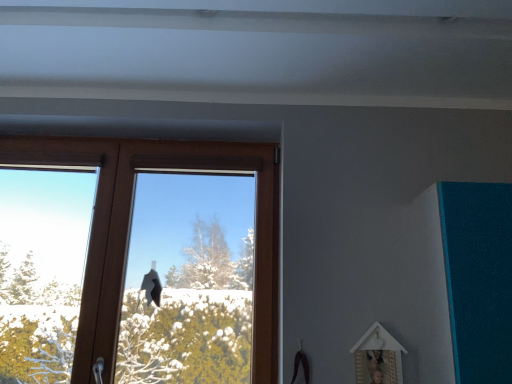
This screenshot has width=512, height=384. What do you see at coordinates (130, 229) in the screenshot?
I see `brown wooden window at center` at bounding box center [130, 229].

Measure the distance between point (220, 145) and camera.

6.35 feet.

Locate an element on the screen. The image size is (512, 384). brown wooden window at center is located at coordinates (130, 229).

Measure the distance between wooden picture frame at lower right and camera.

The depth of wooden picture frame at lower right is 1.49 meters.

Image resolution: width=512 pixels, height=384 pixels. I want to click on wooden picture frame at lower right, so click(378, 356).

What is the approximate height of wooden picture frame at lower right?

10.83 inches.

The image size is (512, 384). Describe the element at coordinates (378, 356) in the screenshot. I see `wooden picture frame at lower right` at that location.

What is the approximate width of wooden picture frame at lower right?

wooden picture frame at lower right is 2.36 inches wide.

I want to click on brown wooden window at center, so click(130, 229).

In the image, is brown wooden window at center on the left side or the right side of wooden picture frame at lower right?

brown wooden window at center is positioned on wooden picture frame at lower right's left side.

Is brown wooden window at center positioned behind wooden picture frame at lower right?

Yes, it is behind wooden picture frame at lower right.

Which point is more distant from viewer, (112, 257) or (357, 374)?

The point (112, 257) is behind.

From the image's perspective, is brown wooden window at center above or below wooden picture frame at lower right?

Clearly, from the image's perspective, brown wooden window at center is above wooden picture frame at lower right.

From a real-world perspective, is brown wooden window at center physically above wooden picture frame at lower right?

Indeed, from a real-world perspective, brown wooden window at center stands above wooden picture frame at lower right.

Considering the sizes of objects brown wooden window at center and wooden picture frame at lower right in the image provided, who is wider, brown wooden window at center or wooden picture frame at lower right?

brown wooden window at center is wider.

Can you confirm if brown wooden window at center is taller than wooden picture frame at lower right?

Yes.

Considering the relative sizes of brown wooden window at center and wooden picture frame at lower right in the image provided, is brown wooden window at center smaller than wooden picture frame at lower right?

No.

Is brown wooden window at center not within wooden picture frame at lower right?

That's correct, brown wooden window at center is outside of wooden picture frame at lower right.

Is there a large distance between brown wooden window at center and wooden picture frame at lower right?

No, brown wooden window at center is not far from wooden picture frame at lower right.

Is brown wooden window at center facing towards wooden picture frame at lower right?

No, brown wooden window at center is not oriented towards wooden picture frame at lower right.

Identify the location of window located above the wooden picture frame at lower right (from a real-world perspective). The width and height of the screenshot is (512, 384). (130, 229).

Is wooden picture frame at lower right at the right side of brown wooden window at center?

Indeed, wooden picture frame at lower right is positioned on the right side of brown wooden window at center.

Does wooden picture frame at lower right come behind brown wooden window at center?

No, it is in front of brown wooden window at center.

Considering the points (381, 352) and (183, 145), which point is in front, point (381, 352) or point (183, 145)?

Positioned in front is point (381, 352).

From the image's perspective, who appears lower, wooden picture frame at lower right or brown wooden window at center?

wooden picture frame at lower right.

From a real-world perspective, is wooden picture frame at lower right above or below brown wooden window at center?

From a real-world perspective, wooden picture frame at lower right is physically below brown wooden window at center.

Which of these two, wooden picture frame at lower right or brown wooden window at center, is thinner?

Thinner between the two is wooden picture frame at lower right.

Which of these two, wooden picture frame at lower right or brown wooden window at center, stands shorter?

wooden picture frame at lower right is shorter.

From the picture: Does wooden picture frame at lower right have a larger size compared to brown wooden window at center?

Incorrect, wooden picture frame at lower right is not larger than brown wooden window at center.

Is wooden picture frame at lower right inside or outside of brown wooden window at center?

wooden picture frame at lower right is not enclosed by brown wooden window at center.

Is wooden picture frame at lower right placed right next to brown wooden window at center?

They are not placed beside each other.

Is wooden picture frame at lower right positioned with its back to brown wooden window at center?

No, wooden picture frame at lower right is not facing the opposite direction of brown wooden window at center.

What's the angular difference between wooden picture frame at lower right and brown wooden window at center's facing directions?

The angular difference between wooden picture frame at lower right and brown wooden window at center is 0.835 degrees.

Where is `window above the wooden picture frame at lower right (from a real-world perspective)`? This screenshot has width=512, height=384. window above the wooden picture frame at lower right (from a real-world perspective) is located at coordinates (130, 229).

This screenshot has height=384, width=512. What are the coordinates of `window behind the wooden picture frame at lower right` in the screenshot? It's located at tap(130, 229).

Locate an element on the screen. The width and height of the screenshot is (512, 384). picture frame that is in front of the brown wooden window at center is located at coordinates (378, 356).